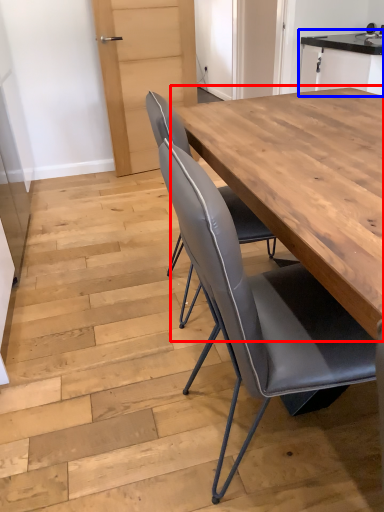
Question: Which of the following is the farthest to the observer, table (highlighted by a red box) or cabinetry (highlighted by a blue box)?

Choices:
 (A) table
 (B) cabinetry

Answer: (B)